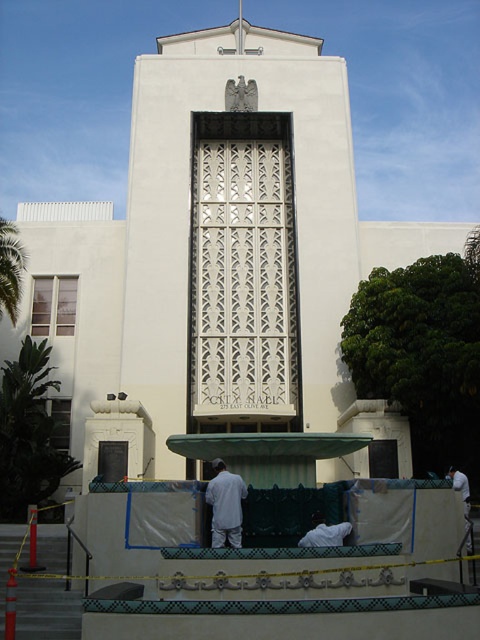
You are attending a formal event and see a white cotton shirt at center and a white fabric at lower right. Which item is more suitable to wear as a formal attire?

The white cotton shirt at center is more suitable to wear as formal attire because it is a complete clothing item, while the white fabric at lower right is just a piece of material.

You are standing in front of the building and see the point at coordinates (226, 506). Based on the scene description, what object is this point located on?

The point at coordinates (226, 506) is located on the white cotton shirt at center.